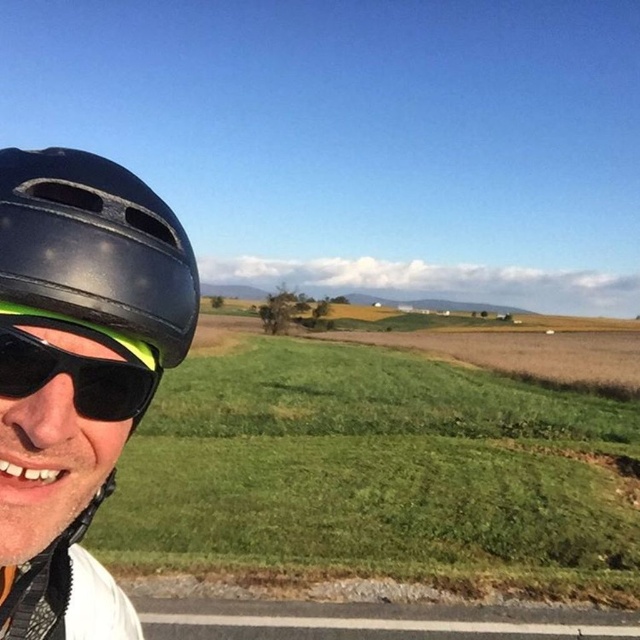
Is black matte helmet at left thinner than black matte sunglasses at left?

No, black matte helmet at left is not thinner than black matte sunglasses at left.

Does black matte helmet at left have a larger size compared to black matte sunglasses at left?

Correct, black matte helmet at left is larger in size than black matte sunglasses at left.

Is point (56, 500) behind point (16, 342)?

Yes, it is behind point (16, 342).

The width and height of the screenshot is (640, 640). I want to click on black matte helmet at left, so click(x=76, y=372).

Is black matte helmet at left closer to camera compared to matte black helmet at left?

No, black matte helmet at left is further to the viewer.

Which is in front, point (26, 154) or point (97, 228)?

Point (97, 228) is more forward.

Is point (163, 269) farther from viewer compared to point (26, 152)?

No.

Find the location of a particular element. The height and width of the screenshot is (640, 640). black matte helmet at left is located at coordinates (76, 372).

Does matte black helmet at left appear under black matte sunglasses at left?

No.

Is matte black helmet at left closer to camera compared to black matte sunglasses at left?

Yes, matte black helmet at left is closer to the viewer.

Identify the location of matte black helmet at left. This screenshot has height=640, width=640. (96, 248).